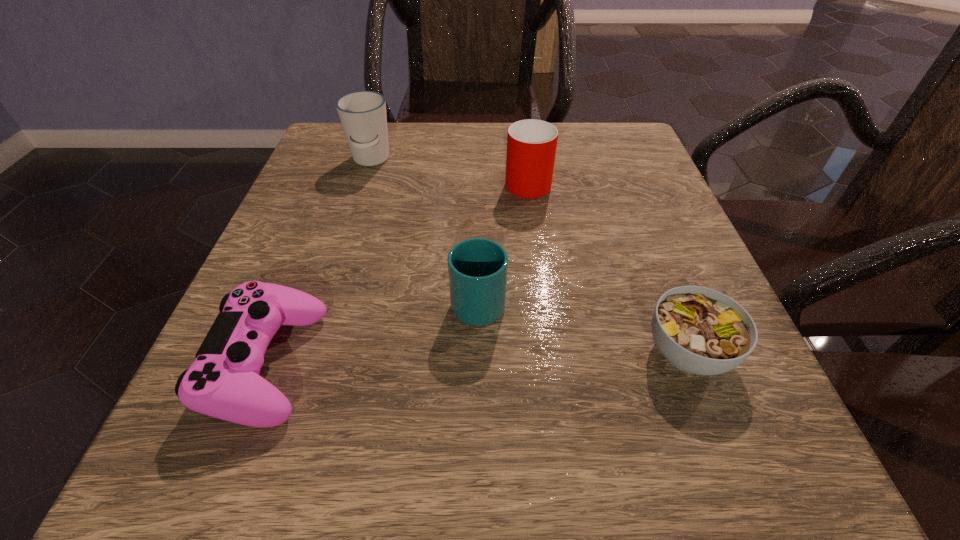
You are a GUI agent. You are given a task and a screenshot of the screen. Output one action in this format:
    pyautogui.click(x=<x>, y=<y>)
    Task: Click on the vacant space at the near edge of the desktop
    
    Given the screenshot: What is the action you would take?
    pyautogui.click(x=598, y=449)

The width and height of the screenshot is (960, 540). I want to click on free space at the left edge of the desktop, so click(x=302, y=207).

At what (x,y) coordinates should I click in order to perform the action: click on vacant space at the right edge of the desktop. Please return your answer as a coordinate pair (x, y). The width and height of the screenshot is (960, 540). Looking at the image, I should click on (695, 255).

In the image, there is a desktop. At what (x,y) coordinates should I click in order to perform the action: click on vacant space at the far right corner. Please return your answer as a coordinate pair (x, y). Looking at the image, I should click on (600, 150).

The width and height of the screenshot is (960, 540). Identify the location of free spot between the rightmost object and the leftmost cup. (529, 256).

Find the location of `vacant space in between the leftmost cup and the control`. vacant space in between the leftmost cup and the control is located at coordinates (320, 261).

The width and height of the screenshot is (960, 540). In order to click on vacant space that is in between the second object from right to left and the soup bowl in this screenshot , I will do `click(608, 266)`.

Where is `free spot between the soup bowl and the fourth object from left to right`? This screenshot has height=540, width=960. free spot between the soup bowl and the fourth object from left to right is located at coordinates (608, 266).

The width and height of the screenshot is (960, 540). Find the location of `blank region between the fourth object from left to right and the rightmost object`. blank region between the fourth object from left to right and the rightmost object is located at coordinates (608, 266).

This screenshot has width=960, height=540. I want to click on empty location between the control and the leftmost cup, so click(320, 261).